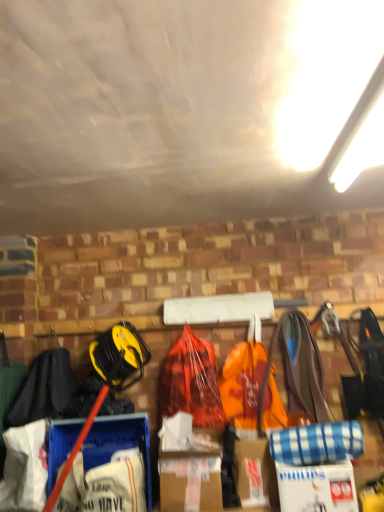
Question: Would you say black fabric at left is outside orange plastic bag at center?

Choices:
 (A) no
 (B) yes

Answer: (B)

Question: Can you confirm if black fabric at left is positioned to the right of orange plastic bag at center?

Choices:
 (A) no
 (B) yes

Answer: (A)

Question: Is black fabric at left oriented away from orange plastic bag at center?

Choices:
 (A) no
 (B) yes

Answer: (A)

Question: Is black fabric at left shorter than orange plastic bag at center?

Choices:
 (A) yes
 (B) no

Answer: (A)

Question: From a real-world perspective, is black fabric at left under orange plastic bag at center?

Choices:
 (A) no
 (B) yes

Answer: (A)

Question: Considering the positions of point (34, 380) and point (241, 382), is point (34, 380) closer or farther from the camera than point (241, 382)?

Choices:
 (A) closer
 (B) farther

Answer: (A)

Question: Is black fabric at left taller or shorter than orange plastic bag at center?

Choices:
 (A) short
 (B) tall

Answer: (A)

Question: Is black fabric at left wider or thinner than orange plastic bag at center?

Choices:
 (A) wide
 (B) thin

Answer: (A)

Question: Is black fabric at left inside the boundaries of orange plastic bag at center, or outside?

Choices:
 (A) inside
 (B) outside

Answer: (B)

Question: Considering the positions of orange plastic bag at center and black fabric at left in the image, is orange plastic bag at center wider or thinner than black fabric at left?

Choices:
 (A) thin
 (B) wide

Answer: (A)

Question: Is orange plastic bag at center taller or shorter than black fabric at left?

Choices:
 (A) short
 (B) tall

Answer: (B)

Question: In the image, is orange plastic bag at center positioned in front of or behind black fabric at left?

Choices:
 (A) behind
 (B) front

Answer: (A)

Question: From a real-world perspective, is orange plastic bag at center physically located above or below black fabric at left?

Choices:
 (A) above
 (B) below

Answer: (B)

Question: Would you say white cardboard box at lower right is inside or outside orange plastic bag at center?

Choices:
 (A) outside
 (B) inside

Answer: (A)

Question: Does point (352, 509) appear closer or farther from the camera than point (160, 377)?

Choices:
 (A) closer
 (B) farther

Answer: (A)